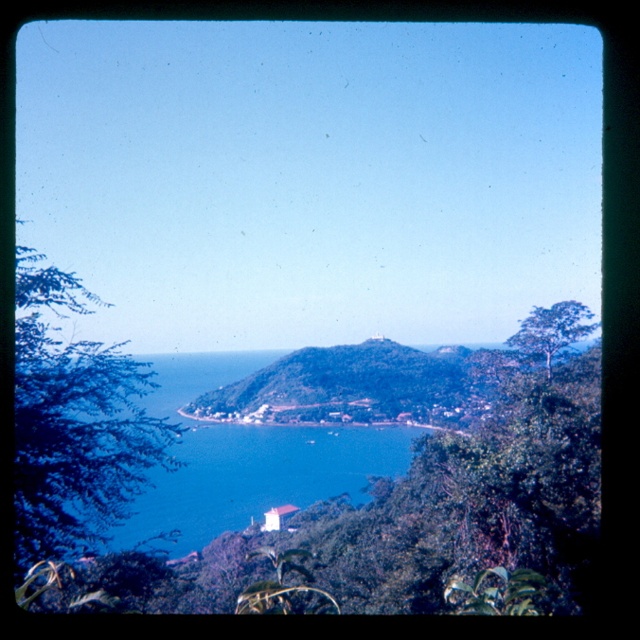
You are standing on the beach looking at the scene. Which object is closer to the horizon, the green leafy hillside at center or the green leafy tree at upper right?

The green leafy tree at upper right is closer to the horizon because it is positioned above the green leafy hillside at center, which is located under it.

You are a bird flying over the coastal landscape. You see the blue water at center and the green leafy tree at upper right. Which object is located to the right of the other?

The green leafy tree at upper right is located to the right of the blue water at center.

You are standing at the edge of the coastal landscape and want to know if the green leafy tree at left is wider or narrower than the blue water at center. Based on the scene, what can you conclude?

The green leafy tree at left is narrower than the blue water at center because its width is less than that of the blue water at center.